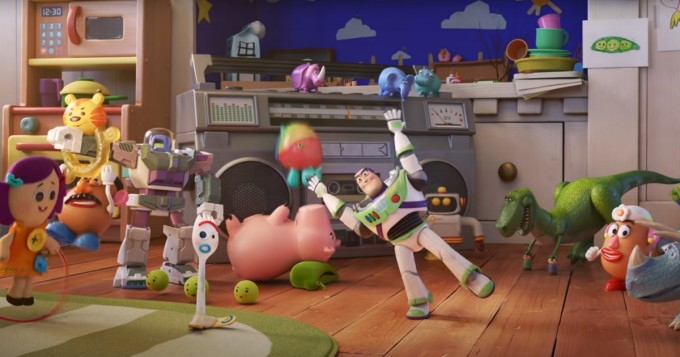
At what (x,y) coordinates should I click in order to perform the action: click on boom box. Please return your answer as a coordinate pair (x, y). The width and height of the screenshot is (680, 357). Looking at the image, I should click on (237, 145).